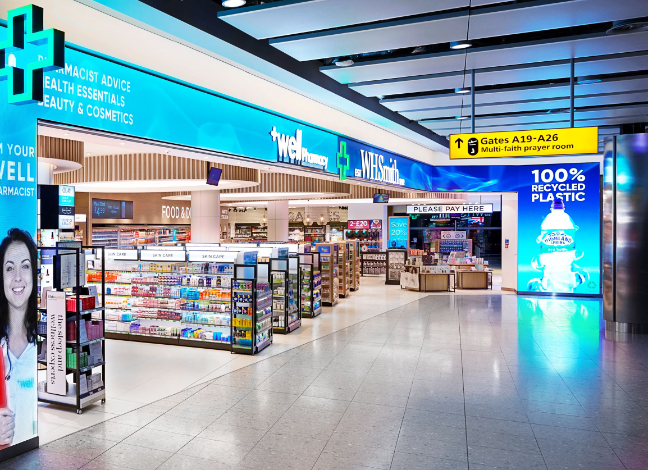
This screenshot has height=470, width=648. In order to click on tv screen in this screenshot , I will do `click(378, 198)`, `click(216, 177)`.